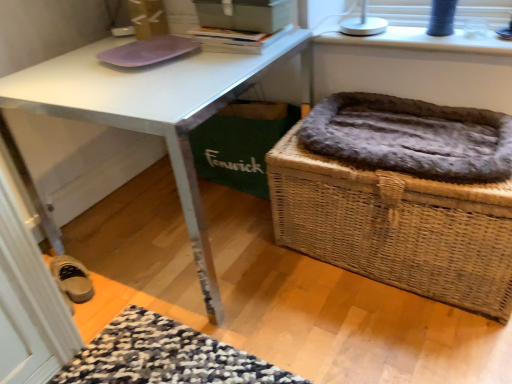
Question: Considering the relative sizes of white plastic lamp at upper right and white glossy desk at center in the image provided, is white plastic lamp at upper right taller than white glossy desk at center?

Choices:
 (A) yes
 (B) no

Answer: (B)

Question: Can you confirm if white plastic lamp at upper right is positioned to the right of white glossy desk at center?

Choices:
 (A) yes
 (B) no

Answer: (A)

Question: Is white plastic lamp at upper right facing towards white glossy desk at center?

Choices:
 (A) yes
 (B) no

Answer: (B)

Question: From a real-world perspective, is white plastic lamp at upper right positioned under white glossy desk at center based on gravity?

Choices:
 (A) yes
 (B) no

Answer: (B)

Question: Does white plastic lamp at upper right touch white glossy desk at center?

Choices:
 (A) yes
 (B) no

Answer: (B)

Question: From their relative heights in the image, would you say hardcover book at upper center is taller or shorter than white plastic lamp at upper right?

Choices:
 (A) short
 (B) tall

Answer: (A)

Question: Does point (x=248, y=36) appear closer or farther from the camera than point (x=414, y=34)?

Choices:
 (A) farther
 (B) closer

Answer: (B)

Question: From the image's perspective, relative to white plastic lamp at upper right, is hardcover book at upper center above or below?

Choices:
 (A) below
 (B) above

Answer: (A)

Question: From a real-world perspective, relative to white plastic lamp at upper right, is hardcover book at upper center vertically above or below?

Choices:
 (A) below
 (B) above

Answer: (B)

Question: From a real-world perspective, is fuzzy brown cat bed at lower right positioned above or below white plastic lamp at upper right?

Choices:
 (A) below
 (B) above

Answer: (A)

Question: Considering the positions of fuzzy brown cat bed at lower right and white plastic lamp at upper right in the image, is fuzzy brown cat bed at lower right wider or thinner than white plastic lamp at upper right?

Choices:
 (A) thin
 (B) wide

Answer: (B)

Question: Is fuzzy brown cat bed at lower right bigger or smaller than white plastic lamp at upper right?

Choices:
 (A) big
 (B) small

Answer: (A)

Question: From the image's perspective, is fuzzy brown cat bed at lower right positioned above or below white plastic lamp at upper right?

Choices:
 (A) below
 (B) above

Answer: (A)

Question: Considering the positions of hardcover book at upper center and matte gray box at upper center in the image, is hardcover book at upper center wider or thinner than matte gray box at upper center?

Choices:
 (A) thin
 (B) wide

Answer: (B)

Question: From a real-world perspective, relative to matte gray box at upper center, is hardcover book at upper center vertically above or below?

Choices:
 (A) below
 (B) above

Answer: (A)